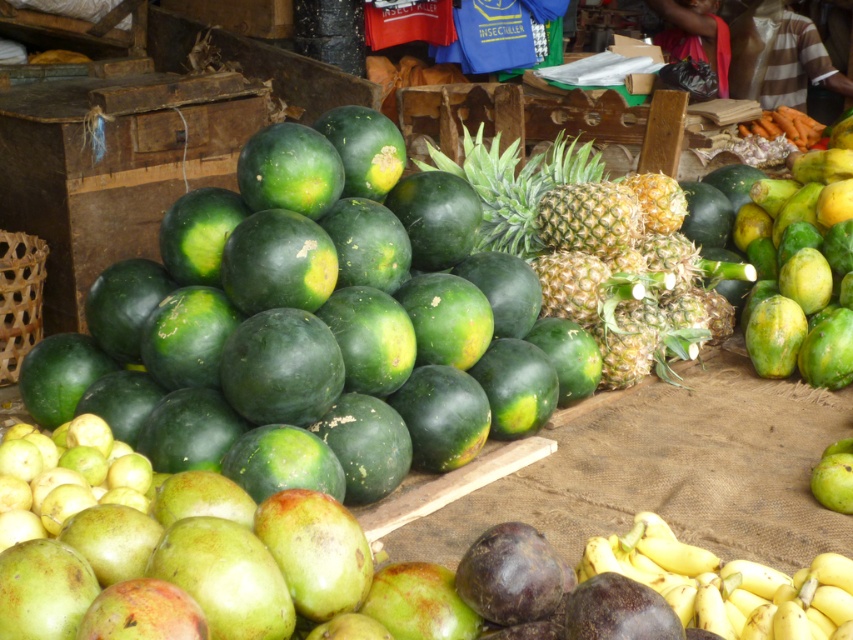
Does yellow-green textured pineapple at center have a lesser height compared to yellow matte bananas at lower right?

No.

Measure the distance between point [647,362] and camera.

A distance of 3.08 meters exists between point [647,362] and camera.

Locate an element on the screen. Image resolution: width=853 pixels, height=640 pixels. yellow-green textured pineapple at center is located at coordinates (595, 252).

Between green matte melon at center and yellow-green textured pineapple at center, which one appears on the right side from the viewer's perspective?

yellow-green textured pineapple at center is more to the right.

Between green matte melon at center and yellow-green textured pineapple at center, which one is positioned higher?

yellow-green textured pineapple at center is higher up.

Is point (235, 284) farther from camera compared to point (642, 205)?

No, it is not.

At what (x,y) coordinates should I click in order to perform the action: click on green matte melon at center. Please return your answer as a coordinate pair (x, y). The width and height of the screenshot is (853, 640). Looking at the image, I should click on (318, 330).

Does point (404, 260) come closer to viewer compared to point (692, 595)?

No, it is behind (692, 595).

Can you confirm if green matte melon at center is positioned to the left of yellow matte bananas at lower right?

Indeed, green matte melon at center is positioned on the left side of yellow matte bananas at lower right.

Find the location of `green matte melon at center`. green matte melon at center is located at coordinates (318, 330).